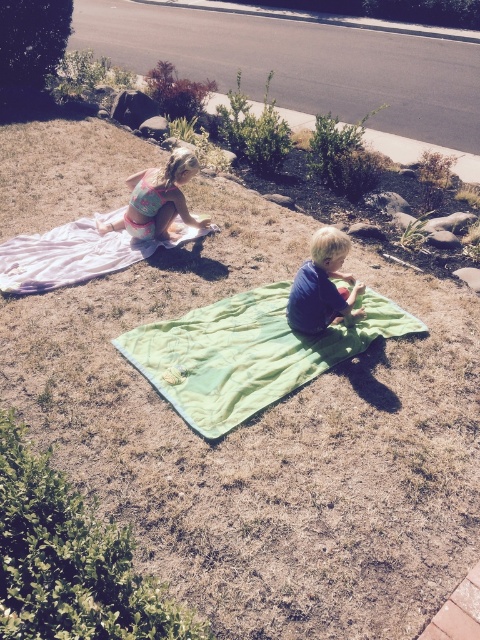
Question: Among these objects, which one is nearest to the camera?

Choices:
 (A) matte pink swimsuit at upper left
 (B) pink fabric blanket at upper left

Answer: (B)

Question: Estimate the real-world distances between objects in this image. Which object is farther from the green quilted blanket at center?

Choices:
 (A) blue cotton shirt at center
 (B) matte pink swimsuit at upper left

Answer: (B)

Question: Is blue cotton shirt at center positioned in front of matte pink swimsuit at upper left?

Choices:
 (A) yes
 (B) no

Answer: (A)

Question: Which of the following is the closest to the observer?

Choices:
 (A) (231, 333)
 (B) (34, 285)
 (C) (305, 289)
 (D) (178, 212)

Answer: (C)

Question: Is pink fabric blanket at upper left below matte pink swimsuit at upper left?

Choices:
 (A) no
 (B) yes

Answer: (B)

Question: Does pink fabric blanket at upper left appear over blue cotton shirt at center?

Choices:
 (A) no
 (B) yes

Answer: (B)